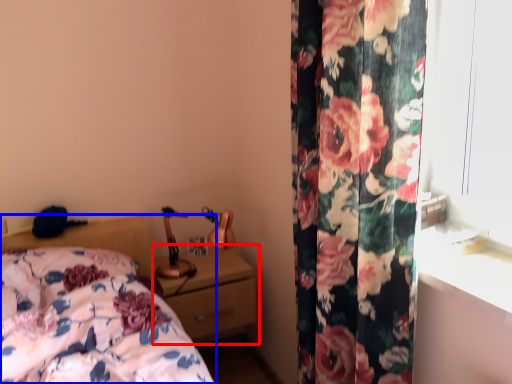
Question: Among these objects, which one is farthest to the camera, nightstand (highlighted by a red box) or bed (highlighted by a blue box)?

Choices:
 (A) nightstand
 (B) bed

Answer: (A)